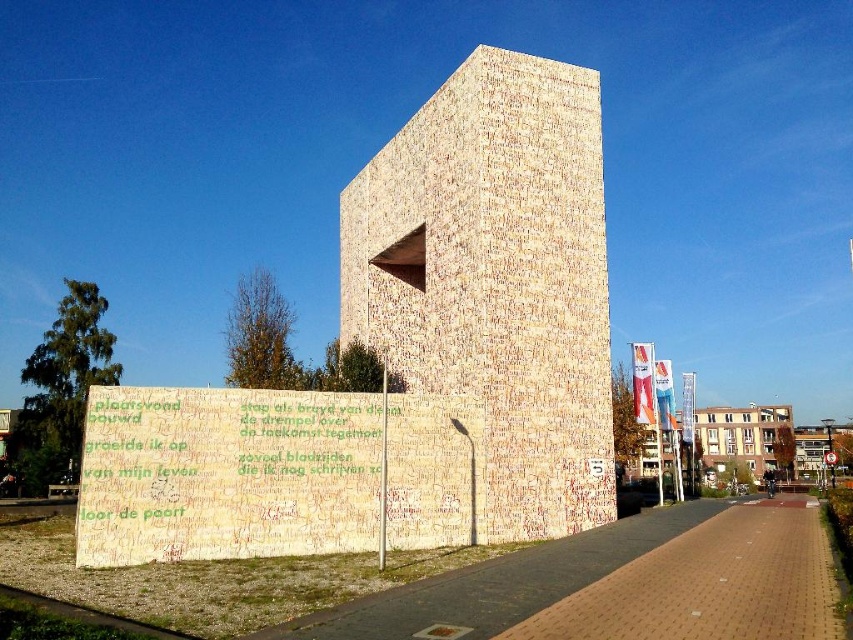
Between beige textured wall at center and white brick building at center, which one has less height?

white brick building at center

Image resolution: width=853 pixels, height=640 pixels. I want to click on beige textured wall at center, so click(496, 278).

Between point (531, 125) and point (766, 452), which one is positioned behind?

Point (766, 452)

Find the location of a particular element. This screenshot has height=640, width=853. beige textured wall at center is located at coordinates (496, 278).